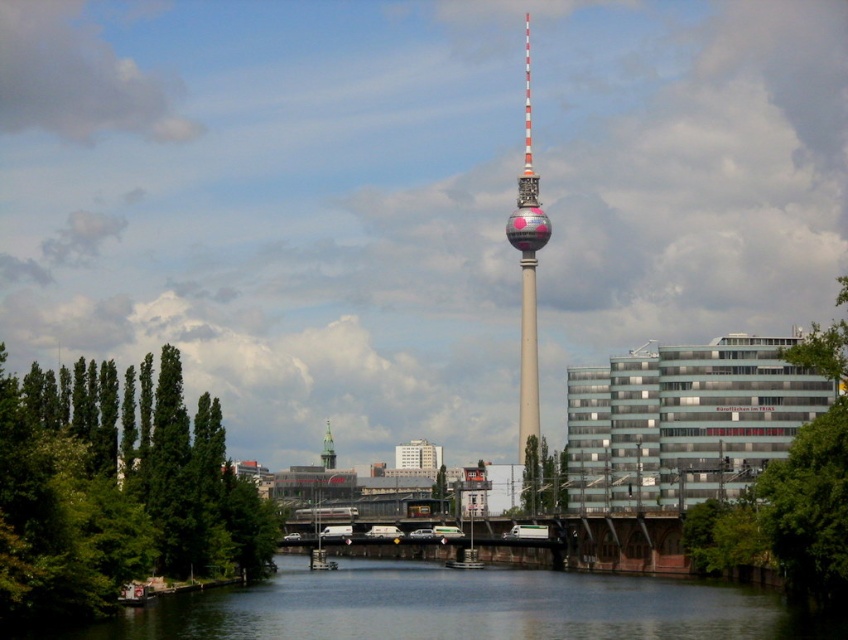
Question: Can you confirm if polished steel tower at center is positioned to the right of silver metallic clock tower at center?

Choices:
 (A) yes
 (B) no

Answer: (A)

Question: Which point is closer to the camera?

Choices:
 (A) smooth dark water at center
 (B) polished steel tower at center
 (C) silver metallic clock tower at center

Answer: (A)

Question: Is polished steel tower at center below silver metallic clock tower at center?

Choices:
 (A) yes
 (B) no

Answer: (B)

Question: Which of the following is the closest to the observer?

Choices:
 (A) (325, 442)
 (B) (525, 410)

Answer: (B)

Question: Observing the image, what is the correct spatial positioning of polished steel tower at center in reference to silver metallic clock tower at center?

Choices:
 (A) left
 (B) right

Answer: (B)

Question: Which object is the closest to the polished steel tower at center?

Choices:
 (A) smooth dark water at center
 (B) silver metallic clock tower at center

Answer: (B)